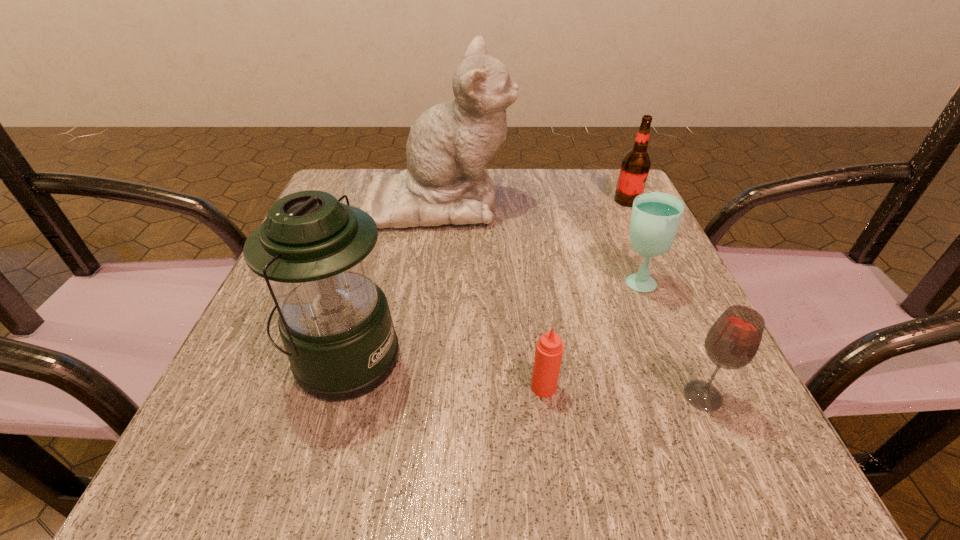
The image size is (960, 540). What are the coordinates of `free space located on the front of the nearer glass drink container` in the screenshot? It's located at (739, 480).

Find the location of a particular element. This screenshot has width=960, height=540. free location located on the back of the Tabasco sauce is located at coordinates (538, 341).

This screenshot has height=540, width=960. I want to click on cat at the far edge, so click(x=446, y=182).

The image size is (960, 540). What are the coordinates of `root beer that is positioned at the far edge` in the screenshot? It's located at (636, 163).

Locate an element on the screen. Image resolution: width=960 pixels, height=540 pixels. cat positioned at the left edge is located at coordinates (446, 182).

Where is `lantern located in the left edge section of the desktop`? Image resolution: width=960 pixels, height=540 pixels. lantern located in the left edge section of the desktop is located at coordinates (335, 323).

Where is `root beer situated at the right edge`? This screenshot has height=540, width=960. root beer situated at the right edge is located at coordinates (636, 163).

Identify the location of object that is at the far left corner. The height and width of the screenshot is (540, 960). (446, 182).

At what (x,y) coordinates should I click in order to perform the action: click on object that is at the far right corner. Please return your answer as a coordinate pair (x, y). Image resolution: width=960 pixels, height=540 pixels. Looking at the image, I should click on (636, 163).

I want to click on vacant area at the far edge, so click(541, 221).